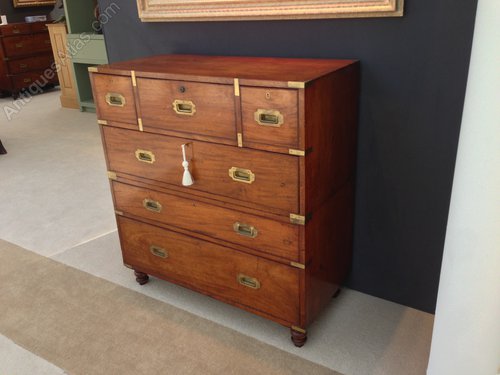
Where is `handle`? handle is located at coordinates (182, 105).